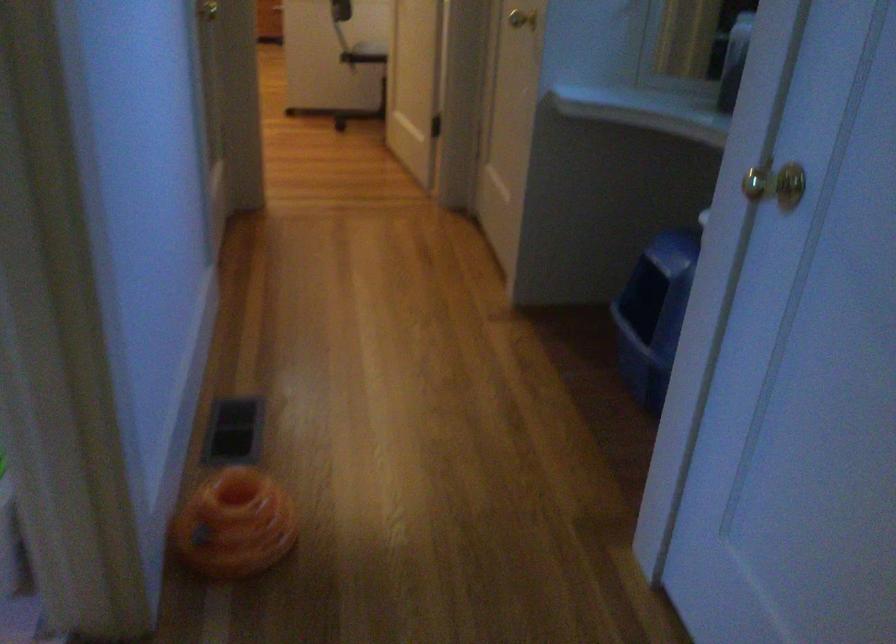
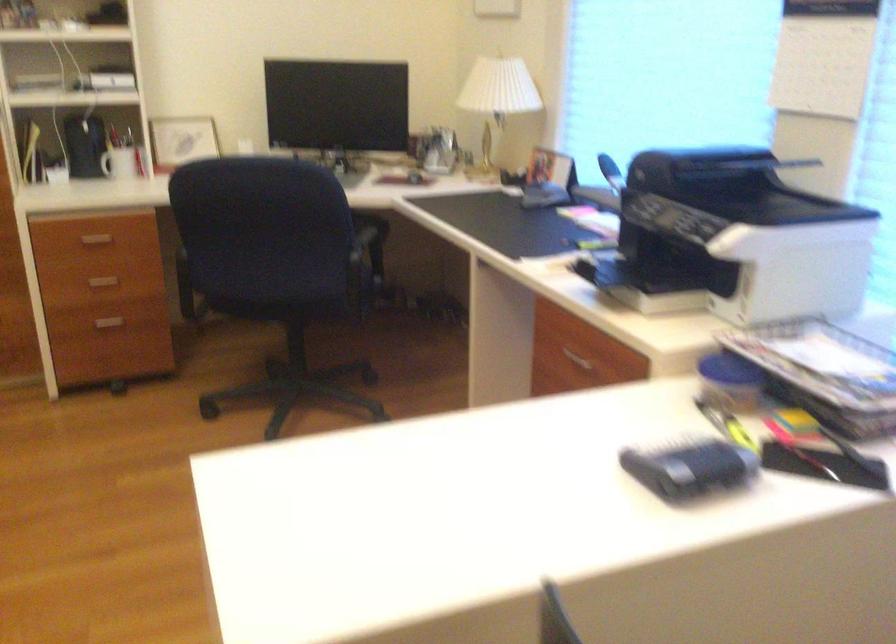
Question: The images are taken continuously from a first-person perspective. In which direction are you moving?

Choices:
 (A) Left
 (B) Right
 (C) Forward
 (D) Backward

Answer: (C)